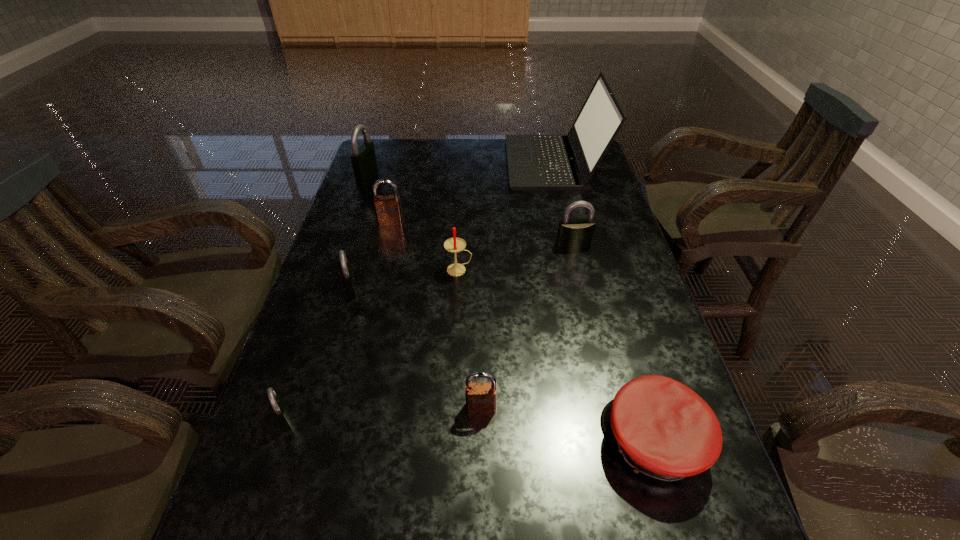
This screenshot has height=540, width=960. In order to click on vacant space located 0.310m on the left of the third nearest black padlock in this screenshot , I will do `click(446, 245)`.

Identify the location of vacant area situated 0.060m on the front-facing side of the fourth object from left to right. Image resolution: width=960 pixels, height=540 pixels. (387, 239).

The width and height of the screenshot is (960, 540). I want to click on vacant space positioned on the front of the fifth nearest object, so click(456, 321).

Where is `free point located on the right of the third nearest padlock`? The height and width of the screenshot is (540, 960). free point located on the right of the third nearest padlock is located at coordinates (387, 289).

This screenshot has width=960, height=540. I want to click on free space located on the front-facing side of the right brown padlock, so click(x=481, y=480).

At what (x,y) coordinates should I click in order to perform the action: click on free space located on the front-facing side of the red cap. Please return your answer as a coordinate pair (x, y). The image size is (960, 540). Looking at the image, I should click on (461, 442).

At what (x,y) coordinates should I click in order to perform the action: click on free space located 0.260m on the front-facing side of the red cap. Please return your answer as a coordinate pair (x, y). Looking at the image, I should click on (467, 442).

This screenshot has width=960, height=540. I want to click on free point located on the front-facing side of the red cap, so 519,442.

Locate an element on the screen. Image resolution: width=960 pixels, height=540 pixels. free space located on the right of the smallest black padlock is located at coordinates (421, 417).

Where is `laptop that is at the far edge`? laptop that is at the far edge is located at coordinates (535, 162).